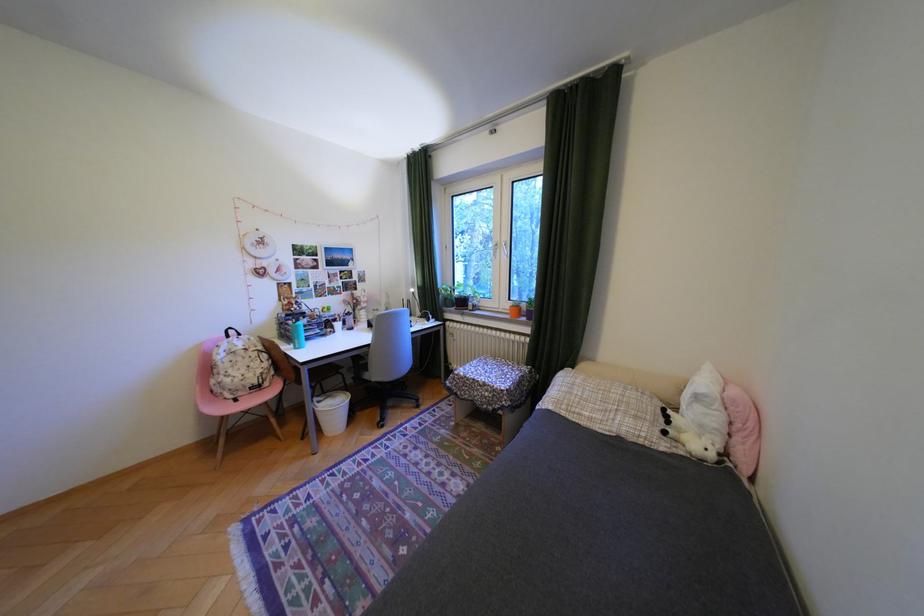
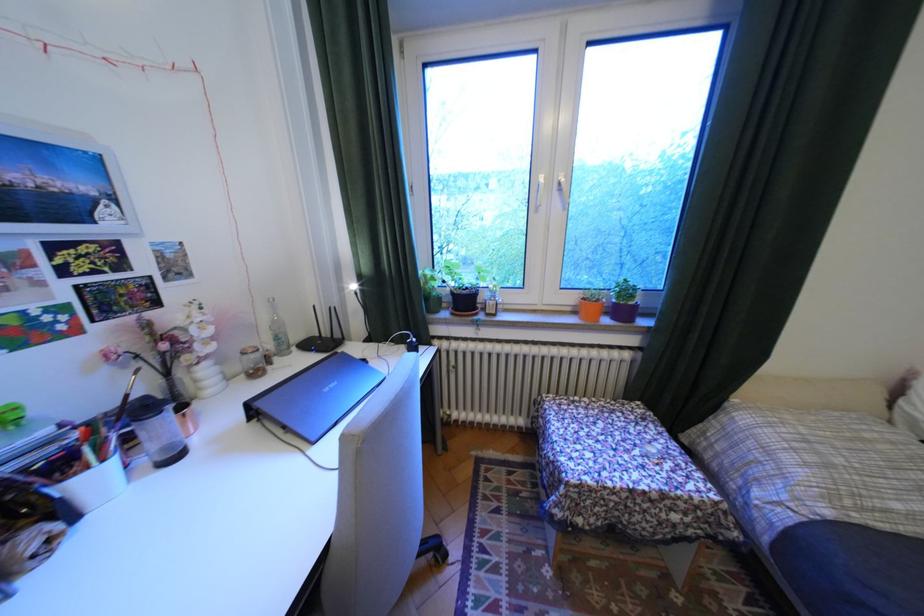
Find the pixel in the second image that matches point 349,325 in the first image.

(106, 479)